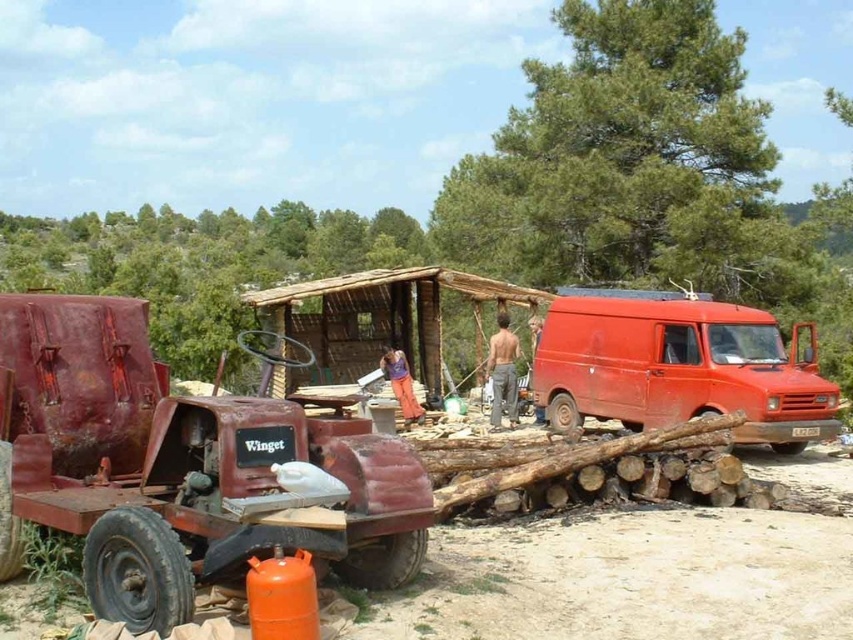
You are planning to park a new compact car that is 1.8 meters wide between the rusty metal trailer truck at left and the matte red van at right. Based on the scene, will the space between them be wide enough for the car?

The rusty metal trailer truck at left is narrower than the matte red van at right, but the exact distance between them isn not provided. However, since the trailer truck is narrower, there might be sufficient space. However, without knowing the actual gap, it is uncertain if 1.8 meters would fit.

You are standing at the point marked by the coordinate point at center, which is labeled as point (679, 368). What object is located at this point?

The point (679, 368) indicates the location of the matte red van at right.

You are a delivery driver who needs to park your truck between the rusty metal trailer truck at left and the matte red van at right. The length of your truck is 8 meters. Can you safely park your truck between them without overlapping either vehicle?

The distance between the rusty metal trailer truck at left and the matte red van at right is 8.40 meters. Since your truck is 8 meters long, there is enough space to park safely between them without overlapping either vehicle.